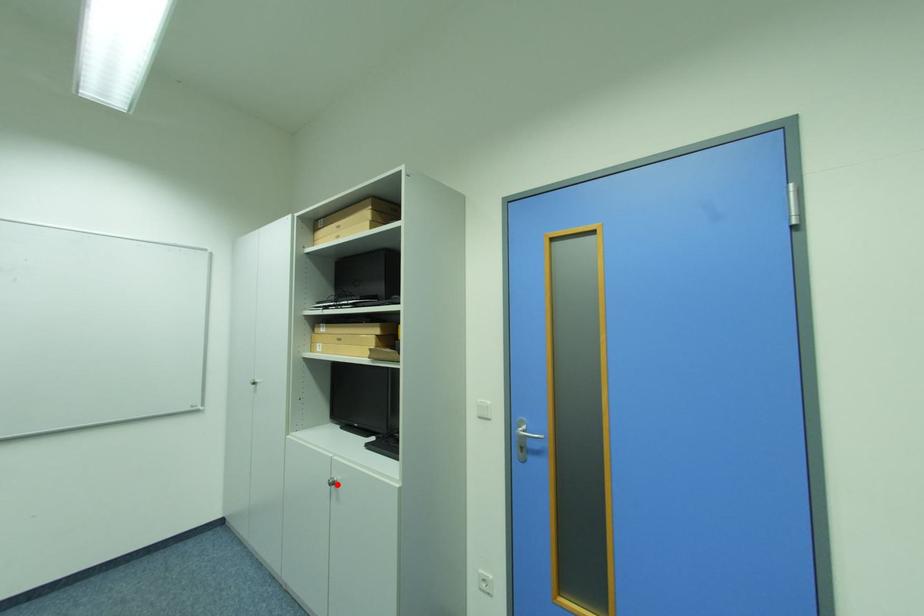
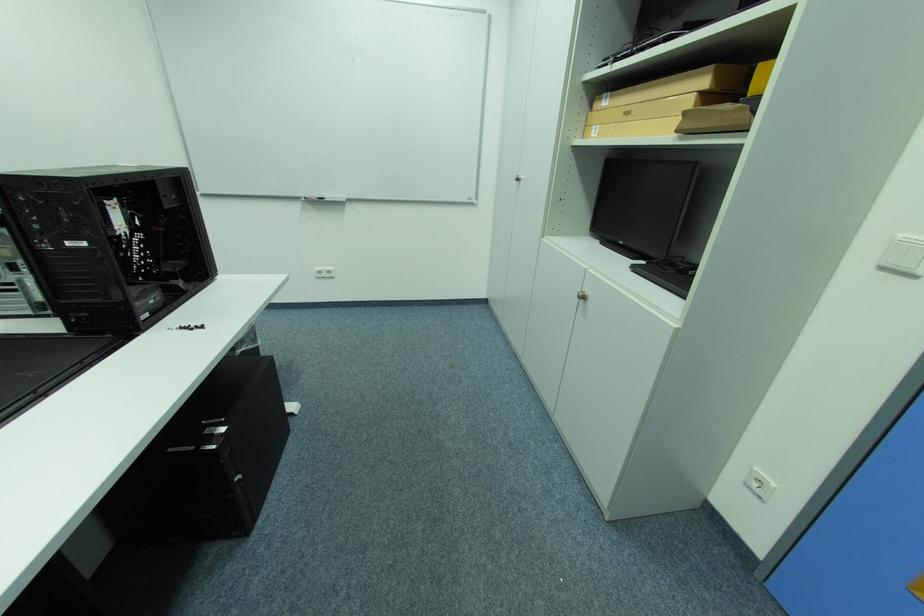
Question: I am providing you with two images of the same scene from different viewpoints. A red point is shown in image1. For the corresponding object point in image2, is it positioned nearer or farther from the camera?

Choices:
 (A) Nearer
 (B) Farther

Answer: (A)